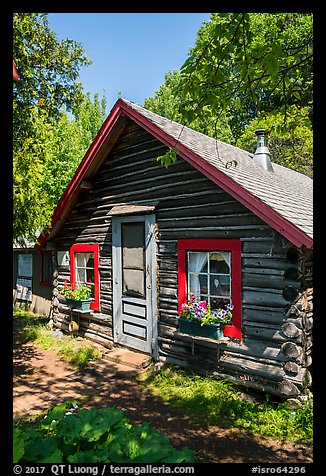
Image resolution: width=326 pixels, height=476 pixels. Find the location of `black rectangular border on bottom door`. black rectangular border on bottom door is located at coordinates (146, 318), (145, 329).